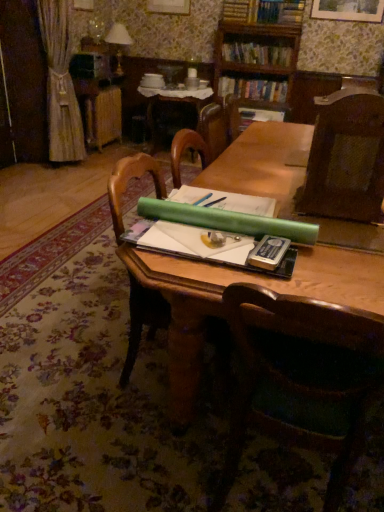
Question: Is brown textured chair at right, which is counted as the 2th chair, starting from the bottom, facing towards metallic silver paperback book at center?

Choices:
 (A) yes
 (B) no

Answer: (B)

Question: Can you confirm if brown textured chair at right, the first chair from the top, is thinner than metallic silver paperback book at center?

Choices:
 (A) yes
 (B) no

Answer: (B)

Question: Can you confirm if brown textured chair at right, which is counted as the 2th chair, starting from the bottom, is bigger than metallic silver paperback book at center?

Choices:
 (A) no
 (B) yes

Answer: (B)

Question: Is the position of brown textured chair at right, which is counted as the 2th chair, starting from the bottom, more distant than that of metallic silver paperback book at center?

Choices:
 (A) no
 (B) yes

Answer: (B)

Question: Considering the relative sizes of brown textured chair at right, which is counted as the 2th chair, starting from the bottom, and metallic silver paperback book at center in the image provided, is brown textured chair at right, which is counted as the 2th chair, starting from the bottom, shorter than metallic silver paperback book at center?

Choices:
 (A) no
 (B) yes

Answer: (A)

Question: Considering the positions of wooden picture frame at upper center and matte white lampshade at upper left in the image, is wooden picture frame at upper center wider or thinner than matte white lampshade at upper left?

Choices:
 (A) thin
 (B) wide

Answer: (A)

Question: Based on their sizes in the image, would you say wooden picture frame at upper center is bigger or smaller than matte white lampshade at upper left?

Choices:
 (A) big
 (B) small

Answer: (B)

Question: From a real-world perspective, relative to matte white lampshade at upper left, is wooden picture frame at upper center vertically above or below?

Choices:
 (A) above
 (B) below

Answer: (A)

Question: Choose the correct answer: Is wooden picture frame at upper center inside matte white lampshade at upper left or outside it?

Choices:
 (A) inside
 (B) outside

Answer: (B)

Question: From a real-world perspective, is wooden bookcase at upper center above or below hardcover book at upper center, marked as the second book in a bottom-to-top arrangement?

Choices:
 (A) above
 (B) below

Answer: (B)

Question: Looking at their shapes, would you say wooden bookcase at upper center is wider or thinner than hardcover book at upper center, marked as the second book in a bottom-to-top arrangement?

Choices:
 (A) wide
 (B) thin

Answer: (A)

Question: In the image, is wooden bookcase at upper center on the left side or the right side of hardcover book at upper center, acting as the 1th book starting from the top?

Choices:
 (A) right
 (B) left

Answer: (B)

Question: Is wooden bookcase at upper center inside or outside of hardcover book at upper center, acting as the 1th book starting from the top?

Choices:
 (A) outside
 (B) inside

Answer: (A)

Question: Does point (117, 40) appear closer or farther from the camera than point (243, 46)?

Choices:
 (A) farther
 (B) closer

Answer: (B)

Question: Relative to hardcover book at upper center, marked as the second book in a bottom-to-top arrangement, is matte white lampshade at upper left in front or behind?

Choices:
 (A) behind
 (B) front

Answer: (A)